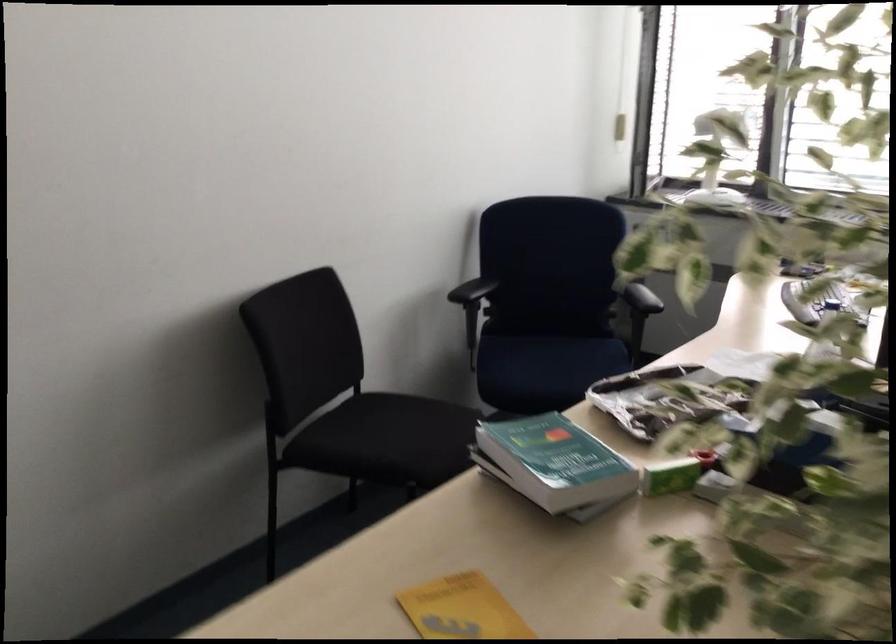
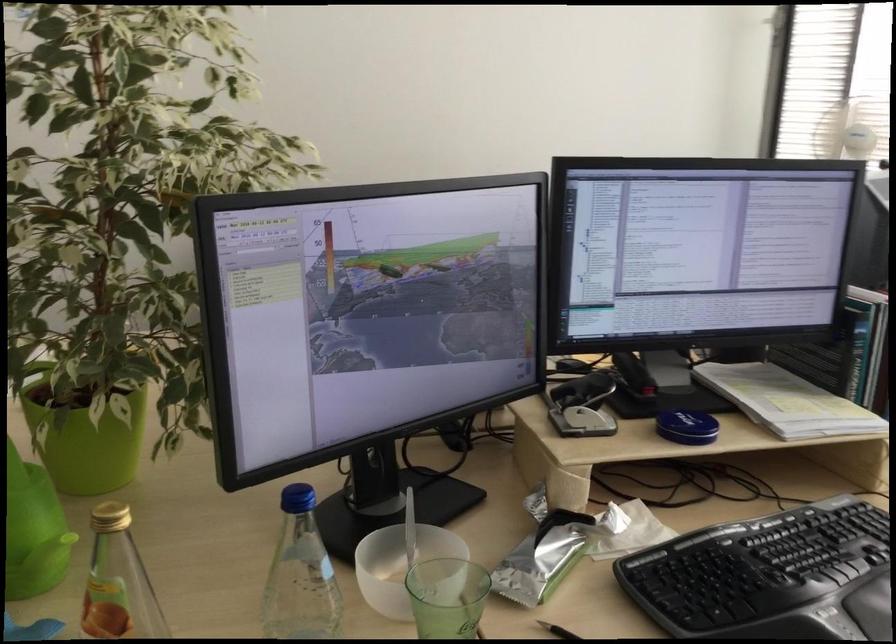
Question: I am providing you with two images of the same scene from different viewpoints. Please identify which objects are invisible in image2.

Choices:
 (A) green glass
 (B) black pen
 (C) green toilet paper roll
 (D) green cover book

Answer: (D)